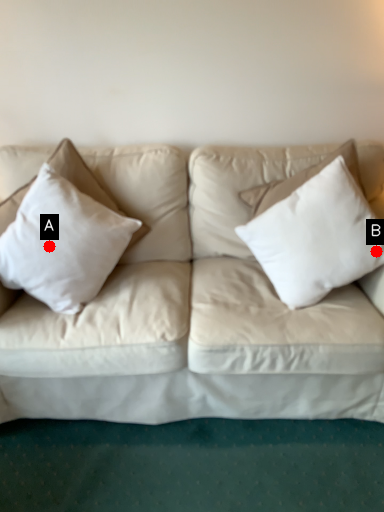
Question: Two points are circled on the image, labeled by A and B beside each circle. Which of the following is the farthest from the observer?

Choices:
 (A) A is further
 (B) B is further

Answer: (A)